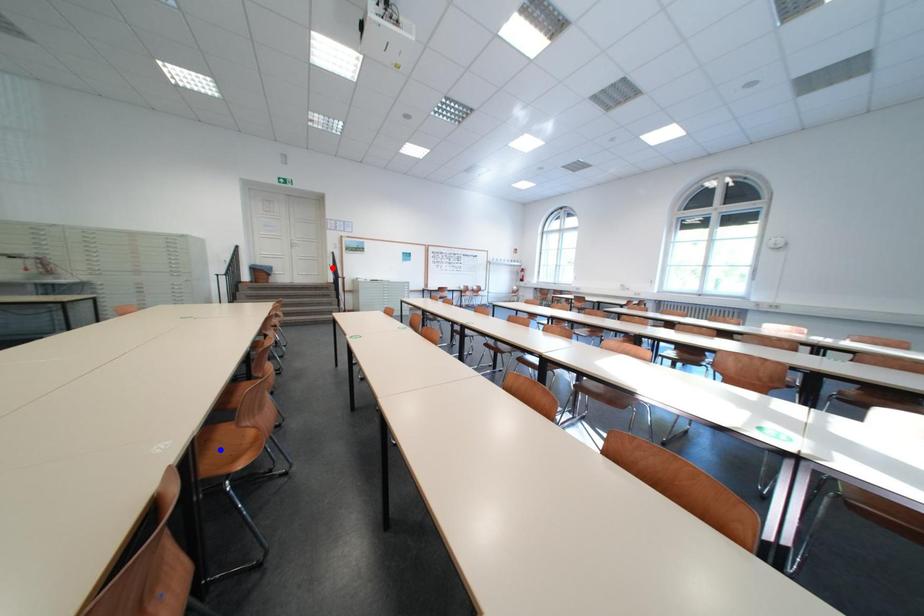
Question: Which of the two points in the image is closer to the camera?

Choices:
 (A) Blue point is closer.
 (B) Red point is closer.

Answer: (A)